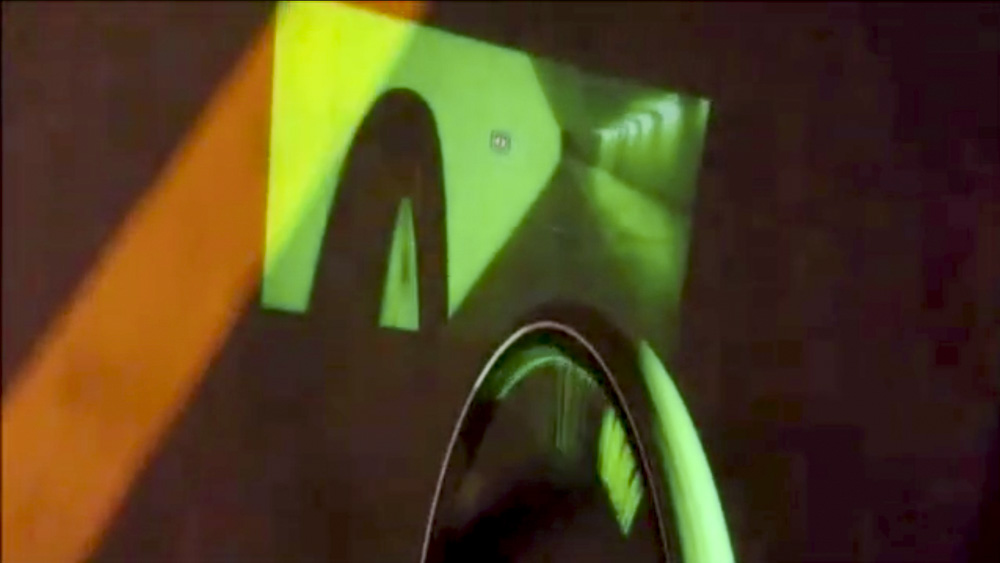
You are a GUI agent. You are given a task and a screenshot of the screen. Output one action in this format:
    pyautogui.click(x=<x>, y=<y>)
    Task: Click on the dark green floor
    The image size is (1000, 563).
    Given the screenshot: What is the action you would take?
    pyautogui.click(x=560, y=263)